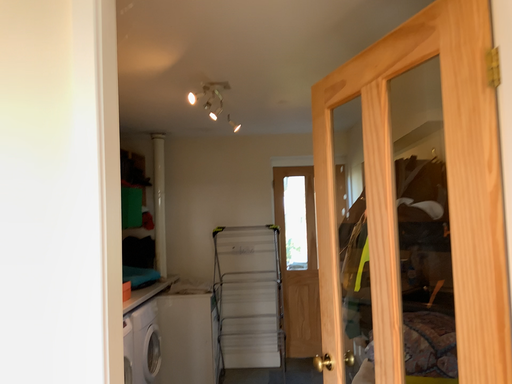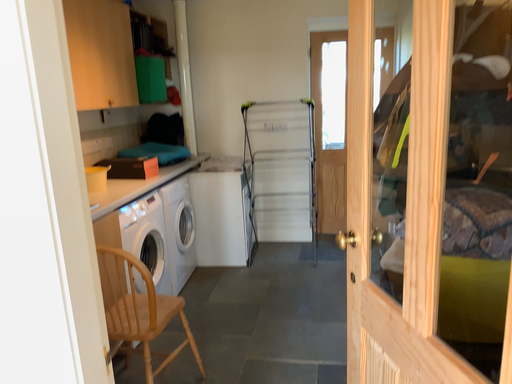
Question: How did the camera likely rotate when shooting the video?

Choices:
 (A) rotated upward
 (B) rotated downward

Answer: (B)